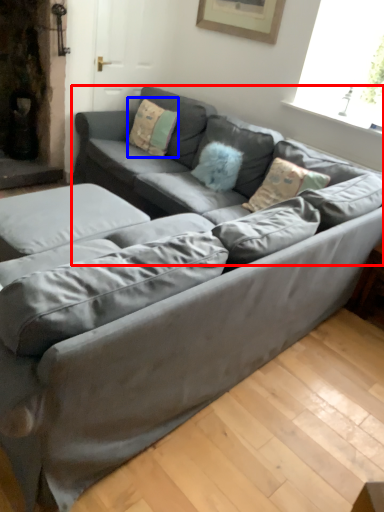
Question: Which point is closer to the camera, couch (highlighted by a red box) or pillow (highlighted by a blue box)?

Choices:
 (A) couch
 (B) pillow

Answer: (A)